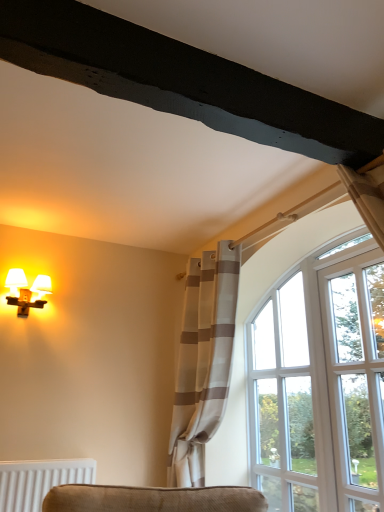
Question: Is the position of clear glass window at upper right less distant than that of matte white sconce at left?

Choices:
 (A) no
 (B) yes

Answer: (B)

Question: Does clear glass window at upper right appear on the left side of matte white sconce at left?

Choices:
 (A) yes
 (B) no

Answer: (B)

Question: Does clear glass window at upper right have a larger size compared to matte white sconce at left?

Choices:
 (A) yes
 (B) no

Answer: (A)

Question: Can you confirm if clear glass window at upper right is shorter than matte white sconce at left?

Choices:
 (A) no
 (B) yes

Answer: (A)

Question: Could you tell me if clear glass window at upper right is turned towards matte white sconce at left?

Choices:
 (A) no
 (B) yes

Answer: (B)

Question: Is white striped curtain at right to the left or to the right of matte white sconce at left in the image?

Choices:
 (A) right
 (B) left

Answer: (A)

Question: Is white striped curtain at right in front of or behind matte white sconce at left in the image?

Choices:
 (A) behind
 (B) front

Answer: (B)

Question: In terms of height, does white striped curtain at right look taller or shorter compared to matte white sconce at left?

Choices:
 (A) tall
 (B) short

Answer: (A)

Question: Is point (195, 346) positioned closer to the camera than point (14, 294)?

Choices:
 (A) farther
 (B) closer

Answer: (A)

Question: Would you say matte white sconce at left is inside or outside clear glass door at right?

Choices:
 (A) inside
 (B) outside

Answer: (B)

Question: Based on their positions, is matte white sconce at left located to the left or right of clear glass door at right?

Choices:
 (A) left
 (B) right

Answer: (A)

Question: In terms of height, does matte white sconce at left look taller or shorter compared to clear glass door at right?

Choices:
 (A) tall
 (B) short

Answer: (B)

Question: Considering the positions of point (44, 300) and point (377, 498), is point (44, 300) closer or farther from the camera than point (377, 498)?

Choices:
 (A) closer
 (B) farther

Answer: (B)

Question: From a real-world perspective, is clear glass window at upper right positioned above or below clear glass door at right?

Choices:
 (A) above
 (B) below

Answer: (B)

Question: Do you think clear glass window at upper right is within clear glass door at right, or outside of it?

Choices:
 (A) outside
 (B) inside

Answer: (A)